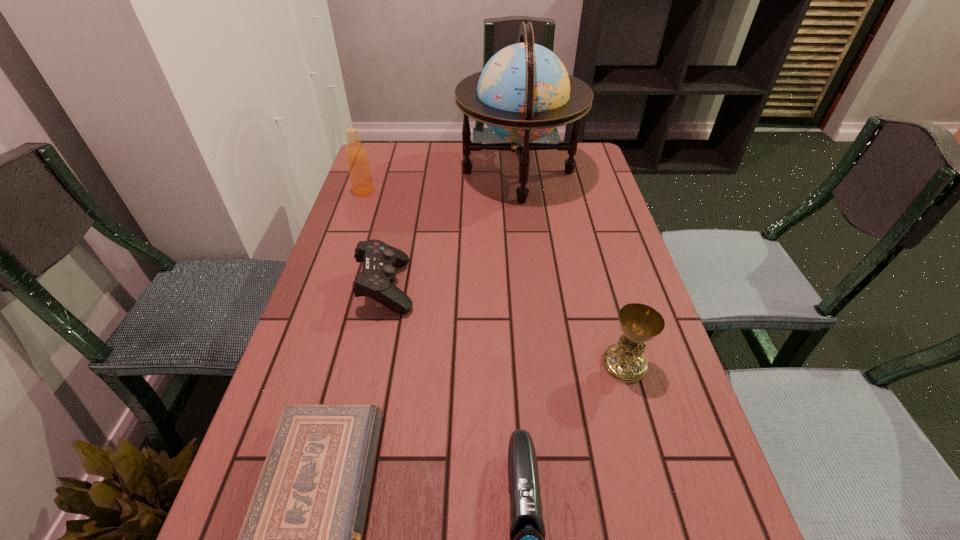
This screenshot has height=540, width=960. In order to click on vacant space at the right edge of the desktop in this screenshot , I will do `click(588, 195)`.

I want to click on vacant space at the far left corner, so click(x=374, y=160).

Find the location of a particular element. This screenshot has width=960, height=540. unoccupied area between the tallest object and the chalice is located at coordinates (571, 268).

The height and width of the screenshot is (540, 960). I want to click on vacant area that lies between the third nearest object and the globe, so click(571, 268).

The image size is (960, 540). In order to click on free spot between the fifth shortest object and the fourth farthest object in this screenshot , I will do `click(494, 278)`.

Locate an element on the screen. This screenshot has width=960, height=540. vacant space in between the chalice and the tallest object is located at coordinates click(571, 268).

This screenshot has height=540, width=960. Find the location of `unoccupied position between the fourth tallest object and the globe`. unoccupied position between the fourth tallest object and the globe is located at coordinates (452, 229).

In order to click on empty space that is in between the third farthest object and the globe in this screenshot , I will do `click(452, 229)`.

Locate an element on the screen. The image size is (960, 540). free space between the globe and the fifth shortest object is located at coordinates (441, 181).

This screenshot has height=540, width=960. Identify the location of object that is the third closest to the third farthest object. (356, 155).